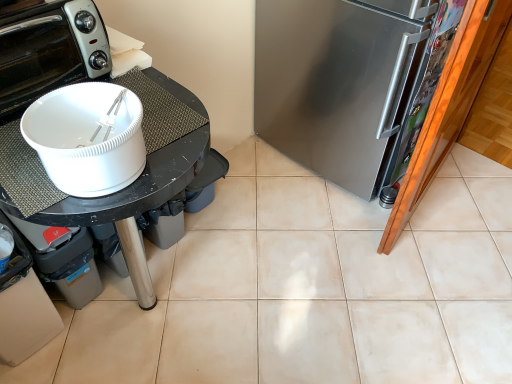
You are a GUI agent. You are given a task and a screenshot of the screen. Output one action in this format:
    pyautogui.click(x=<x>, y=<y>)
    Task: Click on the vacant space that's between black matte table at left and satin silver refrigerator at right
    This screenshot has height=384, width=512.
    Given the screenshot: What is the action you would take?
    pyautogui.click(x=271, y=219)